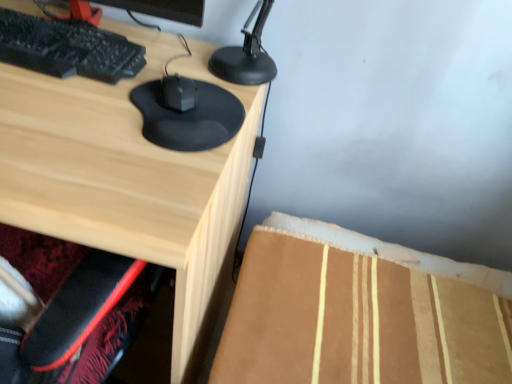
What do you see at coordinates (189, 117) in the screenshot? I see `black matte mouse at center` at bounding box center [189, 117].

Where is `black matte mouse at center`? The height and width of the screenshot is (384, 512). black matte mouse at center is located at coordinates (189, 117).

Find the location of a particular element. matte wood desk at center is located at coordinates (127, 174).

This screenshot has width=512, height=384. Describe the element at coordinates (127, 174) in the screenshot. I see `matte wood desk at center` at that location.

At what (x,y) coordinates should I click in order to perform the action: click on black matte mouse at center. Please return your answer as a coordinate pair (x, y). Image resolution: width=512 pixels, height=384 pixels. Looking at the image, I should click on (189, 117).

Between black matte mouse at center and matte wood desk at center, which one appears on the right side from the viewer's perspective?

Positioned to the right is black matte mouse at center.

Is the position of black matte mouse at center more distant than that of matte wood desk at center?

Yes, black matte mouse at center is behind matte wood desk at center.

Which is in front, point (214, 101) or point (184, 158)?

Positioned in front is point (184, 158).

In the scene shown: From the image's perspective, who appears lower, black matte mouse at center or matte wood desk at center?

matte wood desk at center.

From a real-world perspective, does black matte mouse at center stand above matte wood desk at center?

Correct, in the physical world, black matte mouse at center is higher than matte wood desk at center.

Based on the photo, between black matte mouse at center and matte wood desk at center, which one has smaller width?

black matte mouse at center is thinner.

Based on the photo, considering the sizes of objects black matte mouse at center and matte wood desk at center in the image provided, who is shorter, black matte mouse at center or matte wood desk at center?

black matte mouse at center is shorter.

Does black matte mouse at center have a larger size compared to matte wood desk at center?

Actually, black matte mouse at center might be smaller than matte wood desk at center.

Is black matte mouse at center situated inside matte wood desk at center or outside?

black matte mouse at center is outside matte wood desk at center.

Is black matte mouse at center not near matte wood desk at center?

No, there isn't a large distance between black matte mouse at center and matte wood desk at center.

Is black matte mouse at center facing away from matte wood desk at center?

No, black matte mouse at center's orientation is not away from matte wood desk at center.

This screenshot has width=512, height=384. In order to click on mouse positioned vertically above the matte wood desk at center (from a real-world perspective) in this screenshot , I will do (189, 117).

Does matte wood desk at center appear on the right side of black matte mouse at center?

In fact, matte wood desk at center is to the left of black matte mouse at center.

Which object is further away from the camera, matte wood desk at center or black matte mouse at center?

black matte mouse at center is further away from the camera.

Does point (18, 217) come farther from viewer compared to point (173, 117)?

No, (18, 217) is closer to viewer.

From the image's perspective, which object appears higher, matte wood desk at center or black matte mouse at center?

From the image's view, black matte mouse at center is above.

From a real-world perspective, is matte wood desk at center below black matte mouse at center?

Yes, from a real-world perspective, matte wood desk at center is below black matte mouse at center.

Does matte wood desk at center have a lesser width compared to black matte mouse at center?

Incorrect, the width of matte wood desk at center is not less than that of black matte mouse at center.

Can you confirm if matte wood desk at center is shorter than black matte mouse at center?

No.

Based on their sizes in the image, would you say matte wood desk at center is bigger or smaller than black matte mouse at center?

In the image, matte wood desk at center appears to be larger than black matte mouse at center.

Is black matte mouse at center inside matte wood desk at center?

No, black matte mouse at center is not inside matte wood desk at center.

Is matte wood desk at center far away from black matte mouse at center?

They are positioned close to each other.

Is matte wood desk at center oriented towards black matte mouse at center?

No.

Looking at this image, measure the distance from matte wood desk at center to black matte mouse at center.

The distance of matte wood desk at center from black matte mouse at center is 12.61 centimeters.

Where is `desk on the left of the black matte mouse at center`? This screenshot has height=384, width=512. desk on the left of the black matte mouse at center is located at coordinates (127, 174).

I want to click on mouse above the matte wood desk at center (from a real-world perspective), so click(189, 117).

You are a GUI agent. You are given a task and a screenshot of the screen. Output one action in this format:
    pyautogui.click(x=<x>, y=<y>)
    Task: Click on the mouse on the right of matte wood desk at center
    This screenshot has width=512, height=384.
    Given the screenshot: What is the action you would take?
    pyautogui.click(x=189, y=117)